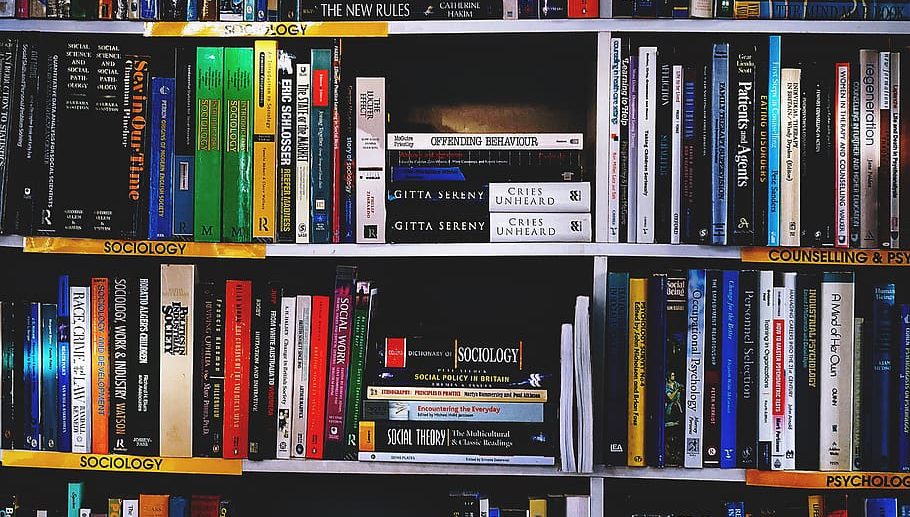
Locate an element on the screen. The image size is (910, 517). books is located at coordinates (291, 334).